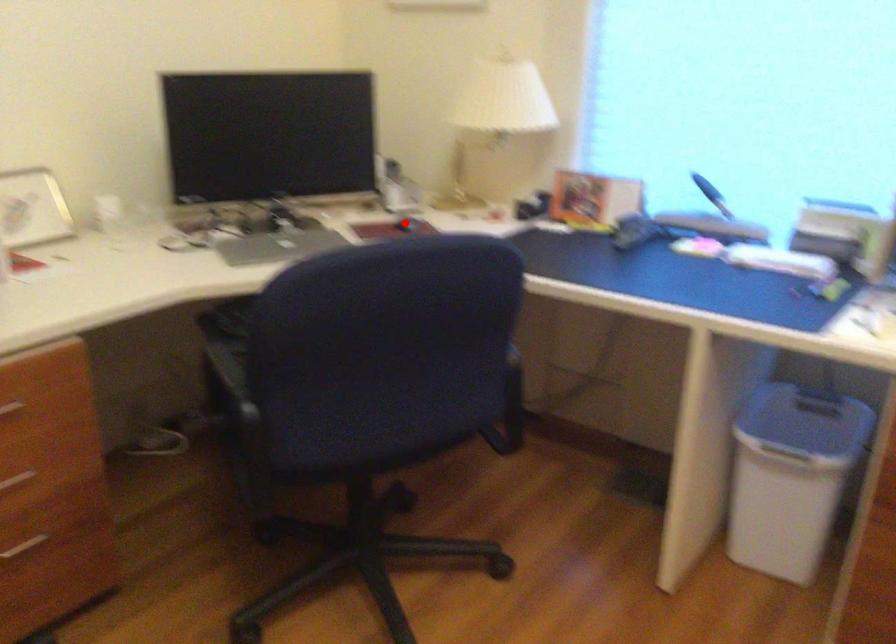
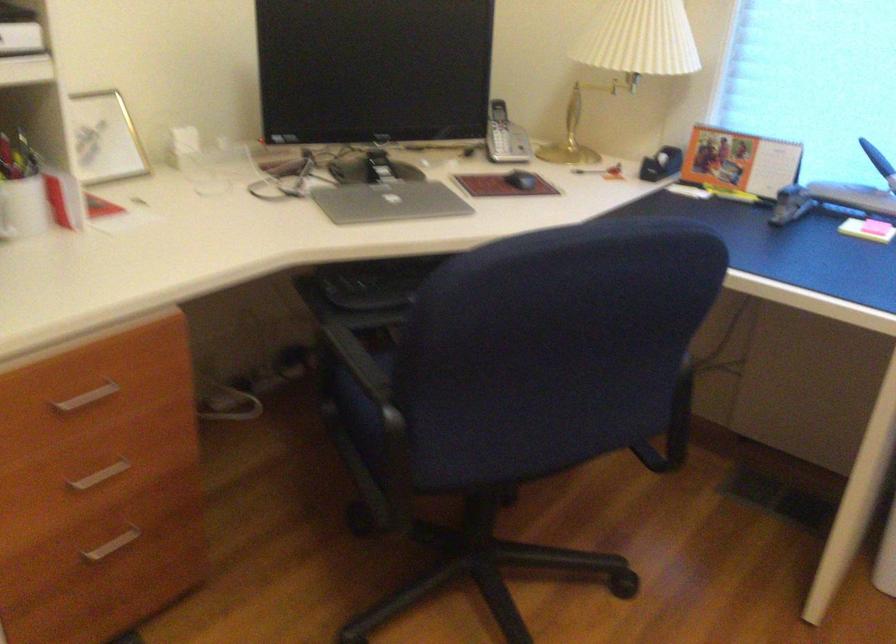
Question: I am providing you with two images of the same scene from different viewpoints. Given a red point in image1, look at the same physical point in image2. Is it:

Choices:
 (A) Closer to the viewpoint
 (B) Farther from the viewpoint

Answer: (A)